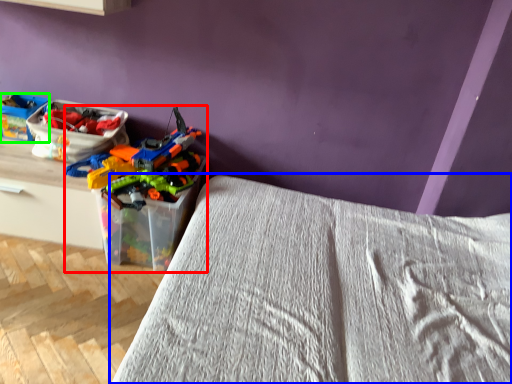
Question: Which object is positioned farthest from toy (highlighted by a red box)? Select from bed (highlighted by a blue box) and kit (highlighted by a green box).

Choices:
 (A) bed
 (B) kit

Answer: (A)